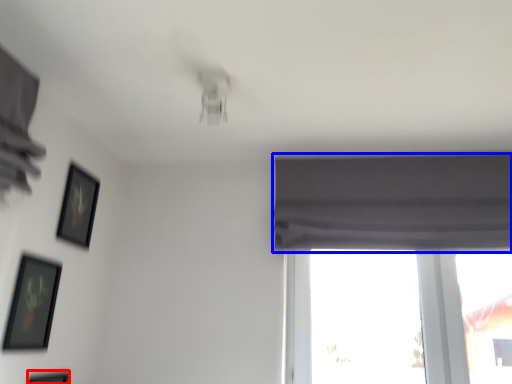
Question: Which of the following is the farthest to the observer, picture frame (highlighted by a red box) or curtain (highlighted by a blue box)?

Choices:
 (A) picture frame
 (B) curtain

Answer: (B)